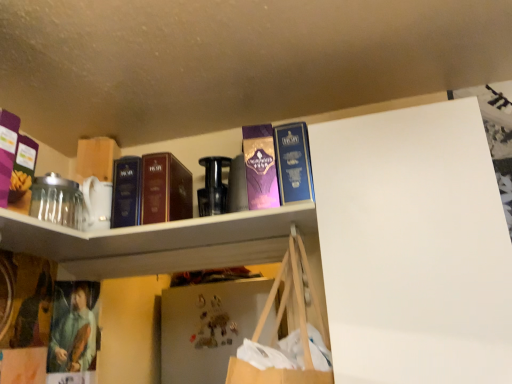
Describe the element at coordinates (7, 151) in the screenshot. The height and width of the screenshot is (384, 512). I see `purple matte box at upper left` at that location.

The height and width of the screenshot is (384, 512). I want to click on purple glossy paperback book at upper center, so click(x=260, y=167).

You are a GUI agent. You are given a task and a screenshot of the screen. Output one action in this format:
    pyautogui.click(x=<x>, y=<y>)
    Task: Click on the blue hardcover book at upper center, acting as the 1th book starting from the right
    Image resolution: width=512 pixels, height=384 pixels.
    Given the screenshot: What is the action you would take?
    pyautogui.click(x=293, y=163)

Where is `purple matte box at upper left`? purple matte box at upper left is located at coordinates (7, 151).

Can you confirm if matte brown book at upper center, arranged as the second book when viewed from the right, is thinner than metallic gold magnet at center?

No, matte brown book at upper center, arranged as the second book when viewed from the right, is not thinner than metallic gold magnet at center.

In the scene shown: Can metallic gold magnet at center be found inside matte brown book at upper center, which is the 2th book from left to right?

No.

Is matte brown book at upper center, which is the 2th book from left to right, smaller than metallic gold magnet at center?

No.

Between blue hardcover book at upper center, acting as the 1th book starting from the right, and matte brown book at upper center, arranged as the second book when viewed from the right, which one has smaller width?

matte brown book at upper center, arranged as the second book when viewed from the right.

From a real-world perspective, between blue hardcover book at upper center, placed as the 3th book when sorted from left to right, and matte brown book at upper center, arranged as the second book when viewed from the right, who is vertically higher?

In real-world perspective, matte brown book at upper center, arranged as the second book when viewed from the right, is above.

Starting from the blue hardcover book at upper center, acting as the 1th book starting from the right, which book is the 1st one to the left? Please provide its 2D coordinates.

[(165, 189)]

Which is closer to the camera, (298, 175) or (148, 212)?

Point (298, 175) is positioned closer to the camera compared to point (148, 212).

Which object is more forward, purple glossy paperback book at upper center or purple matte box at upper left?

purple matte box at upper left is in front.

Would you say purple glossy paperback book at upper center is outside purple matte box at upper left?

Yes, purple glossy paperback book at upper center is outside of purple matte box at upper left.

Is purple glossy paperback book at upper center smaller than purple matte box at upper left?

Incorrect, purple glossy paperback book at upper center is not smaller in size than purple matte box at upper left.

Is purple glossy paperback book at upper center placed right next to purple matte box at upper left?

No, purple glossy paperback book at upper center is not next to purple matte box at upper left.

Between dark blue hardcover book at center, marked as the third book in a right-to-left arrangement, and metallic gold magnet at center, which one appears on the left side from the viewer's perspective?

Positioned to the left is dark blue hardcover book at center, marked as the third book in a right-to-left arrangement.

How far apart are dark blue hardcover book at center, the first book from the left, and metallic gold magnet at center?

dark blue hardcover book at center, the first book from the left, and metallic gold magnet at center are 39.19 inches apart from each other.

Is dark blue hardcover book at center, marked as the third book in a right-to-left arrangement, in front of or behind metallic gold magnet at center in the image?

In the image, dark blue hardcover book at center, marked as the third book in a right-to-left arrangement, appears in front of metallic gold magnet at center.

Between point (119, 192) and point (201, 296), which one is positioned in front?

Positioned in front is point (119, 192).

Can you tell me how much dark blue hardcover book at center, marked as the third book in a right-to-left arrangement, and matte brown book at upper center, which is the 2th book from left to right, differ in facing direction?

They differ by 2.29 degrees in their facing directions.

From the picture: Which is correct: dark blue hardcover book at center, marked as the third book in a right-to-left arrangement, is inside matte brown book at upper center, arranged as the second book when viewed from the right, or outside of it?

dark blue hardcover book at center, marked as the third book in a right-to-left arrangement, is outside matte brown book at upper center, arranged as the second book when viewed from the right.

Considering the sizes of objects dark blue hardcover book at center, marked as the third book in a right-to-left arrangement, and matte brown book at upper center, which is the 2th book from left to right, in the image provided, who is thinner, dark blue hardcover book at center, marked as the third book in a right-to-left arrangement, or matte brown book at upper center, which is the 2th book from left to right,?

matte brown book at upper center, which is the 2th book from left to right, is thinner.

Does point (133, 215) lie behind point (179, 200)?

No, it is in front of (179, 200).

Which of these two, white glossy shelf at upper center or purple matte box at upper left, stands shorter?

Standing shorter between the two is white glossy shelf at upper center.

Considering the positions of objects white glossy shelf at upper center and purple matte box at upper left in the image provided, who is more to the right, white glossy shelf at upper center or purple matte box at upper left?

white glossy shelf at upper center.

Between white glossy shelf at upper center and purple matte box at upper left, which one has smaller size?

purple matte box at upper left.

From the image's perspective, is white glossy shelf at upper center located beneath purple matte box at upper left?

Yes, from the image's perspective, white glossy shelf at upper center is below purple matte box at upper left.

Considering the relative positions of purple glossy paperback book at upper center and metallic gold magnet at center in the image provided, is purple glossy paperback book at upper center to the left or to the right of metallic gold magnet at center?

From the image, it's evident that purple glossy paperback book at upper center is to the right of metallic gold magnet at center.

Looking at the image, does purple glossy paperback book at upper center seem bigger or smaller compared to metallic gold magnet at center?

In the image, purple glossy paperback book at upper center appears to be larger than metallic gold magnet at center.

How different are the orientations of purple glossy paperback book at upper center and metallic gold magnet at center in degrees?

The angle between the facing direction of purple glossy paperback book at upper center and the facing direction of metallic gold magnet at center is 0.886 degrees.

From the image's perspective, is purple glossy paperback book at upper center located above metallic gold magnet at center?

Correct, purple glossy paperback book at upper center appears higher than metallic gold magnet at center in the image.

In order to click on the 1st book to the left when counting from the metallic gold magnet at center in this screenshot , I will do `click(165, 189)`.

At what (x,y) coordinates should I click in order to perform the action: click on the 1st book behind the blue hardcover book at upper center, placed as the 3th book when sorted from left to right. Please return your answer as a coordinate pair (x, y). Looking at the image, I should click on (165, 189).

Based on their spatial positions, is purple glossy paperback book at upper center or matte brown book at upper center, arranged as the second book when viewed from the right, closer to metallic gold magnet at center?

Based on the image, matte brown book at upper center, arranged as the second book when viewed from the right, appears to be nearer to metallic gold magnet at center.

Which object lies further to the anchor point metallic black bottle at center, blue hardcover book at upper center, acting as the 1th book starting from the right, or purple glossy paperback book at upper center?

blue hardcover book at upper center, acting as the 1th book starting from the right.

Estimate the real-world distances between objects in this image. Which object is further from matte brown book at upper center, which is the 2th book from left to right, metallic gold magnet at center or purple matte box at upper left?

The object further to matte brown book at upper center, which is the 2th book from left to right, is metallic gold magnet at center.

Based on their spatial positions, is metallic black bottle at center or white glossy shelf at upper center closer to purple matte box at upper left?

white glossy shelf at upper center is closer to purple matte box at upper left.

Estimate the real-world distances between objects in this image. Which object is further from metallic black bottle at center, metallic gold magnet at center or white glossy shelf at upper center?

Among the two, metallic gold magnet at center is located further to metallic black bottle at center.

When comparing their distances from purple matte box at upper left, does white glossy shelf at upper center or metallic gold magnet at center seem further?

metallic gold magnet at center is further to purple matte box at upper left.

Looking at the image, which one is located closer to blue hardcover book at upper center, acting as the 1th book starting from the right, purple glossy paperback book at upper center or metallic black bottle at center?

Based on the image, purple glossy paperback book at upper center appears to be nearer to blue hardcover book at upper center, acting as the 1th book starting from the right.

Looking at the image, which one is located closer to metallic black bottle at center, dark blue hardcover book at center, the first book from the left, or white glossy shelf at upper center?

dark blue hardcover book at center, the first book from the left, is closer to metallic black bottle at center.

Find the location of a particular element. The height and width of the screenshot is (384, 512). bottle between purple glossy paperback book at upper center and metallic gold magnet at center from front to back is located at coordinates (213, 186).

This screenshot has width=512, height=384. What are the coordinates of `bottle positioned between matte brown book at upper center, arranged as the second book when viewed from the right, and metallic gold magnet at center from near to far` in the screenshot? It's located at (213, 186).

This screenshot has height=384, width=512. What are the coordinates of `bottle between purple matte box at upper left and purple glossy paperback book at upper center in the horizontal direction` in the screenshot? It's located at (213, 186).

Where is `paperback book located between matte brown book at upper center, arranged as the second book when viewed from the right, and blue hardcover book at upper center, acting as the 1th book starting from the right, in the left-right direction`? This screenshot has width=512, height=384. paperback book located between matte brown book at upper center, arranged as the second book when viewed from the right, and blue hardcover book at upper center, acting as the 1th book starting from the right, in the left-right direction is located at coordinates (260, 167).